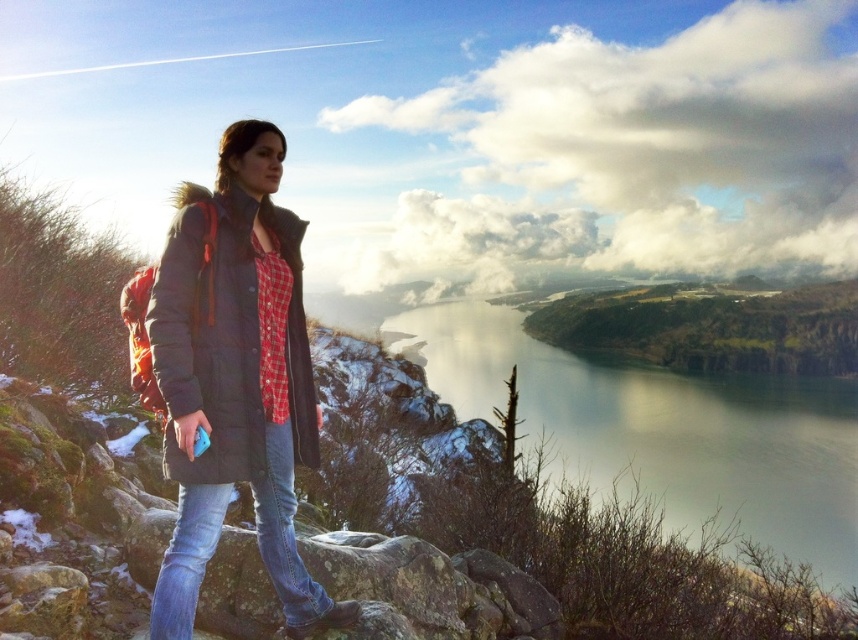
Question: Which object appears farthest from the camera in this image?

Choices:
 (A) dark gray puffer jacket at left
 (B) matte black jacket at center

Answer: (B)

Question: Is dark gray puffer jacket at left smaller than green grassy hillside at upper center?

Choices:
 (A) no
 (B) yes

Answer: (B)

Question: Which object is farther from the camera taking this photo?

Choices:
 (A) dark gray puffer jacket at left
 (B) green reflective water at center

Answer: (B)

Question: Can you confirm if green reflective water at center is smaller than matte black jacket at center?

Choices:
 (A) yes
 (B) no

Answer: (B)

Question: Is green grassy hillside at upper center smaller than blue denim jeans at lower left?

Choices:
 (A) no
 (B) yes

Answer: (A)

Question: Which of the following is the closest to the observer?

Choices:
 (A) (203, 497)
 (B) (844, 520)
 (C) (201, 236)

Answer: (A)